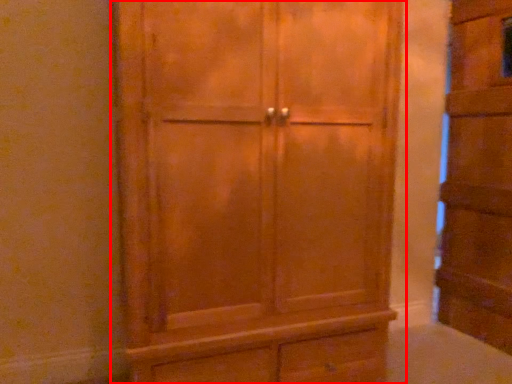
Question: From the image's perspective, where is cupboard (annotated by the red box) located in relation to cupboard in the image?

Choices:
 (A) above
 (B) below

Answer: (B)